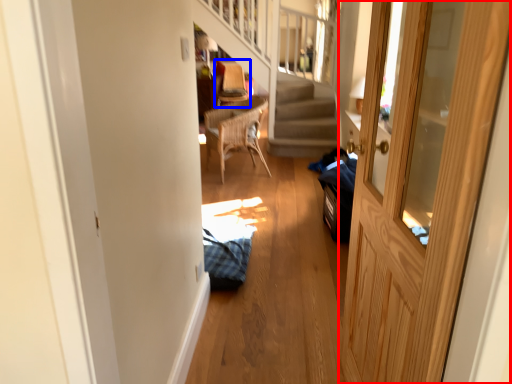
Question: Which object is closer to the camera taking this photo, door (highlighted by a red box) or armchair (highlighted by a blue box)?

Choices:
 (A) door
 (B) armchair

Answer: (A)